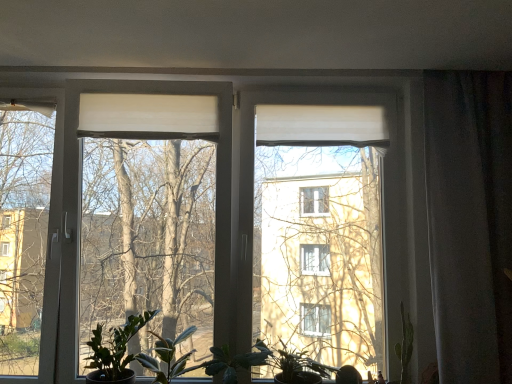
Question: From a real-world perspective, is white matte curtain at right on green matte plant at lower center, the third houseplant viewed from the left?

Choices:
 (A) yes
 (B) no

Answer: (A)

Question: Can you see white matte curtain at right touching green matte plant at lower center, the third houseplant viewed from the left?

Choices:
 (A) no
 (B) yes

Answer: (A)

Question: Does white matte curtain at right lie behind green matte plant at lower center, marked as the first houseplant in a right-to-left arrangement?

Choices:
 (A) no
 (B) yes

Answer: (B)

Question: Is white matte curtain at right not near green matte plant at lower center, marked as the first houseplant in a right-to-left arrangement?

Choices:
 (A) yes
 (B) no

Answer: (B)

Question: Is white matte curtain at right positioned with its back to green matte plant at lower center, marked as the first houseplant in a right-to-left arrangement?

Choices:
 (A) no
 (B) yes

Answer: (A)

Question: Does white matte curtain at right have a smaller size compared to green matte plant at lower center, marked as the first houseplant in a right-to-left arrangement?

Choices:
 (A) no
 (B) yes

Answer: (A)

Question: Is green matte leafy plant at center touching green matte plant at lower left, which appears as the 3th houseplant when viewed from the right?

Choices:
 (A) yes
 (B) no

Answer: (B)

Question: Does green matte leafy plant at center turn towards green matte plant at lower left, the first houseplant in the left-to-right sequence?

Choices:
 (A) no
 (B) yes

Answer: (A)

Question: Can you confirm if green matte leafy plant at center is smaller than green matte plant at lower left, which appears as the 3th houseplant when viewed from the right?

Choices:
 (A) no
 (B) yes

Answer: (A)

Question: Are green matte leafy plant at center and green matte plant at lower left, the first houseplant in the left-to-right sequence, far apart?

Choices:
 (A) no
 (B) yes

Answer: (A)

Question: From the image's perspective, would you say green matte leafy plant at center is shown under green matte plant at lower left, which appears as the 3th houseplant when viewed from the right?

Choices:
 (A) yes
 (B) no

Answer: (A)

Question: Can you confirm if green matte leafy plant at center is thinner than green matte plant at lower left, which appears as the 3th houseplant when viewed from the right?

Choices:
 (A) yes
 (B) no

Answer: (B)

Question: Is the depth of green matte plant at lower left, the first houseplant in the left-to-right sequence, greater than that of green matte leafy plant at center?

Choices:
 (A) no
 (B) yes

Answer: (B)